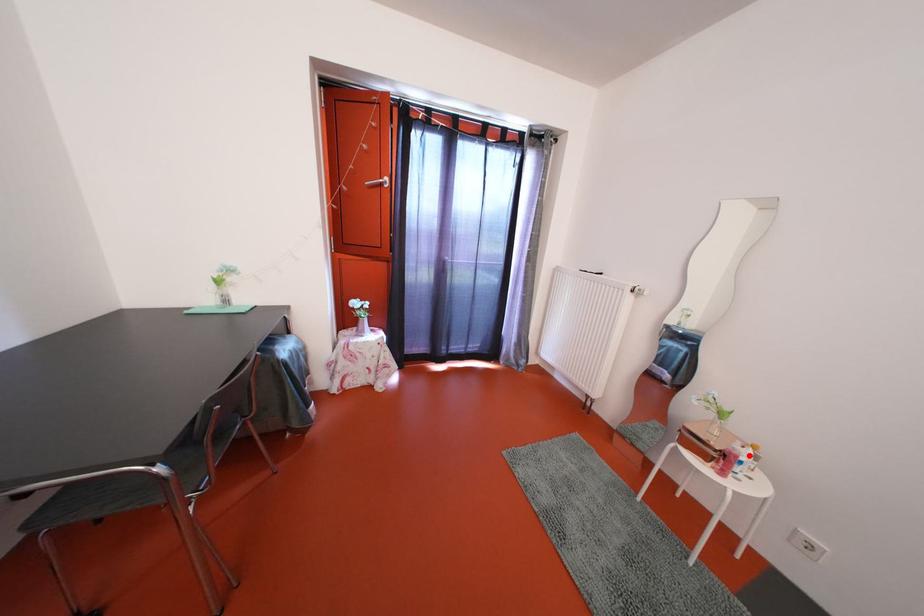
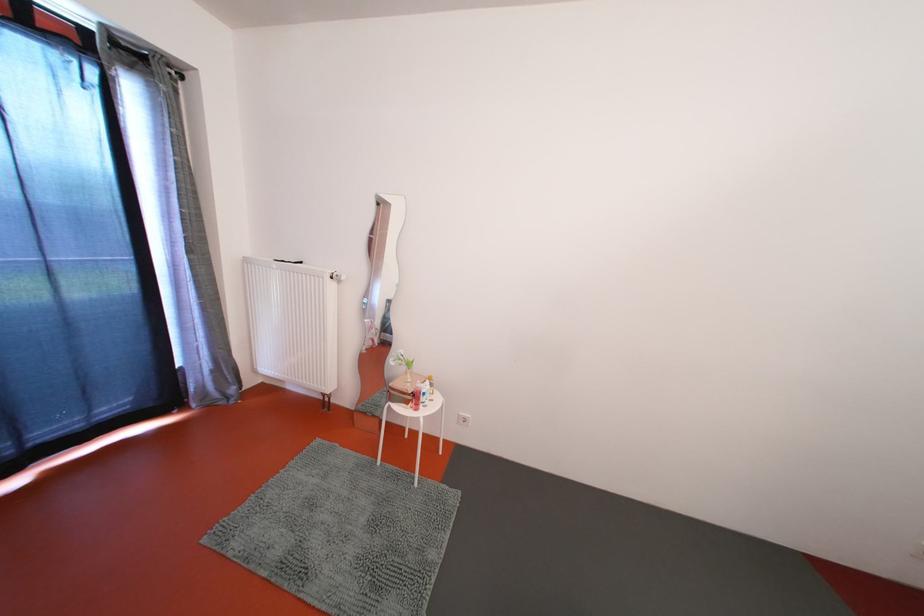
Find the pixel in the second image that matches the highlighted location in the first image.

(429, 391)